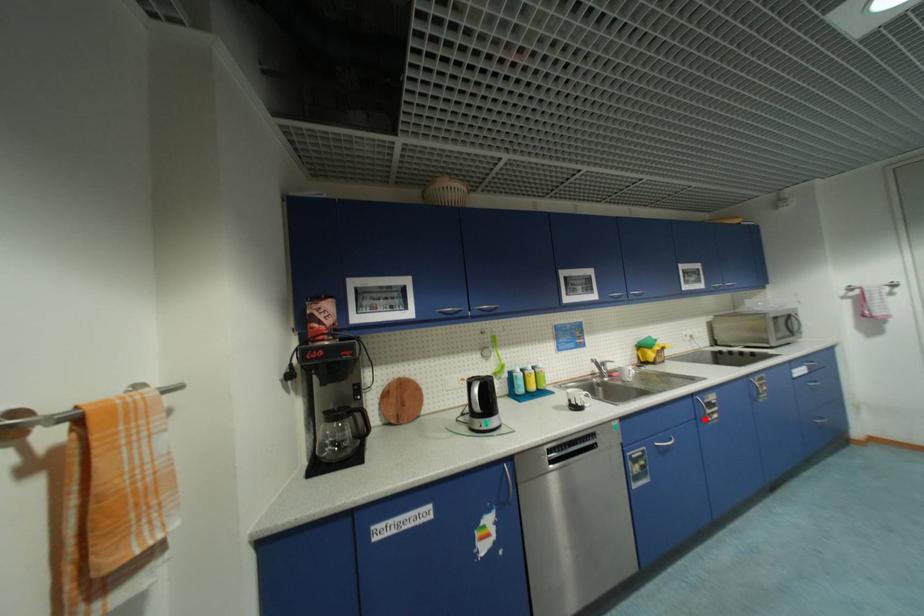
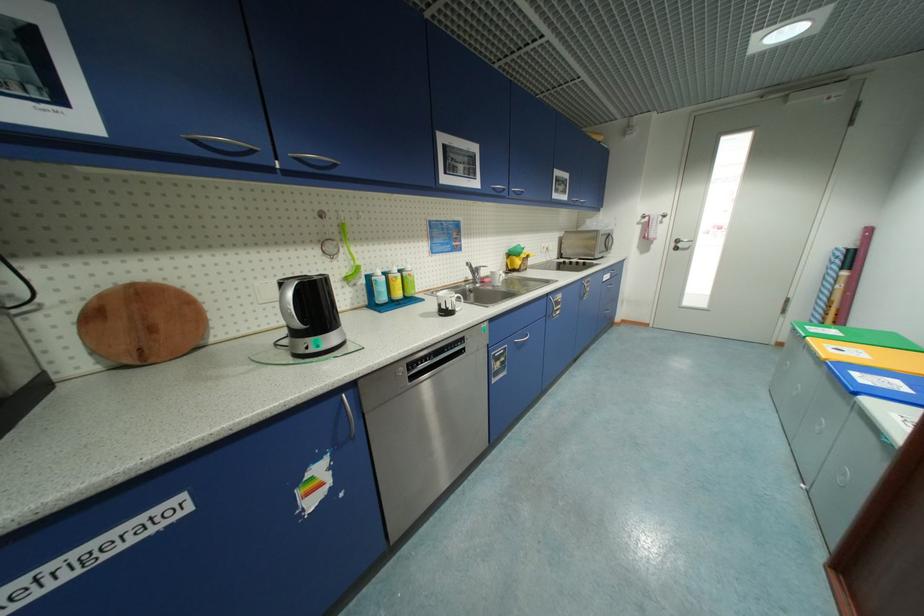
Locate, in the second image, the point that corresponds to the highlighted location in the first image.

(553, 315)